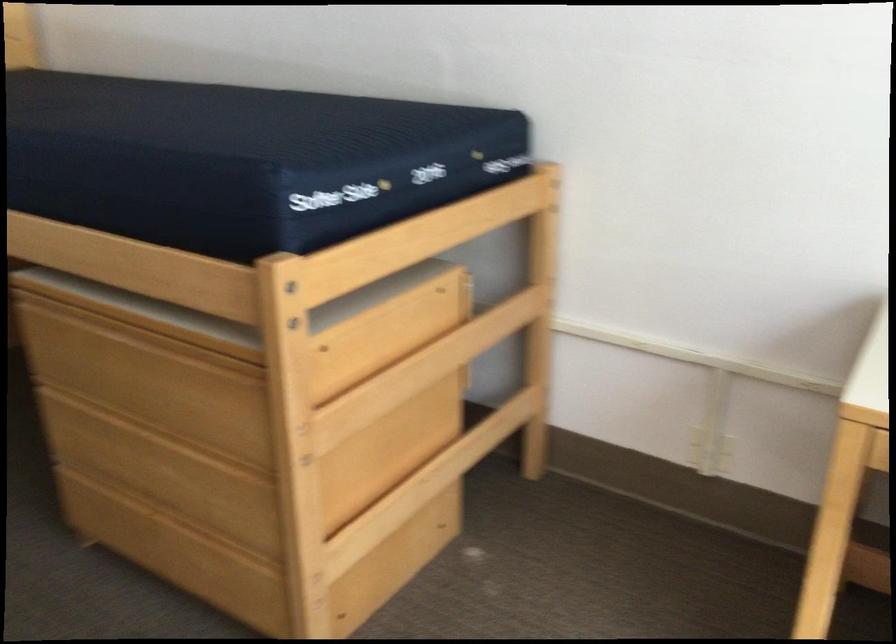
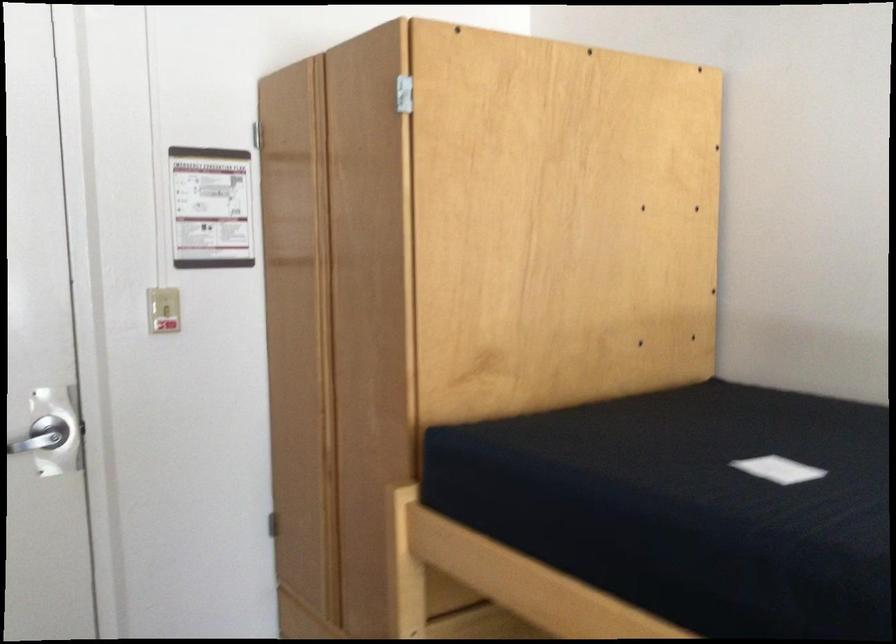
The images are taken continuously from a first-person perspective. In which direction are you moving?

The movement direction of the cameraman is left, forward.